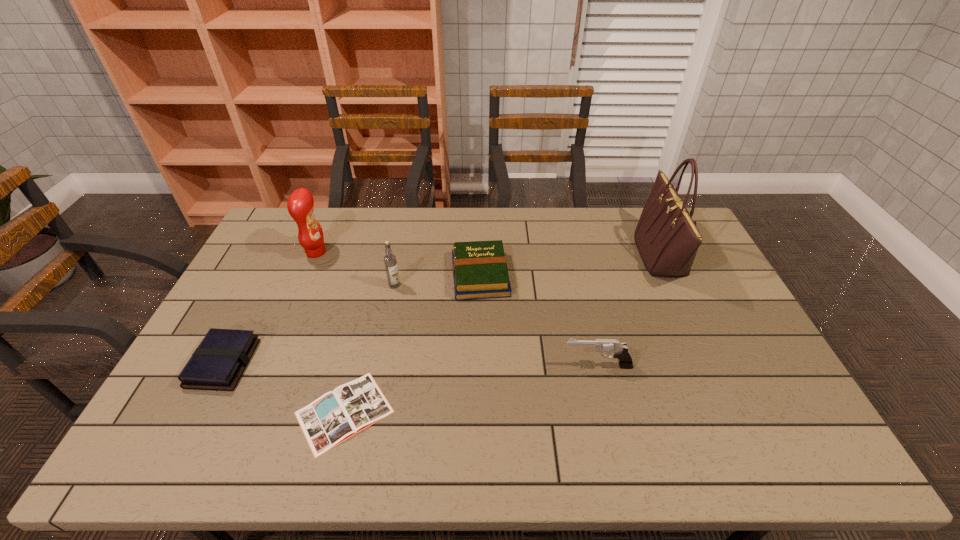
Where is `the leftmost book`? The width and height of the screenshot is (960, 540). the leftmost book is located at coordinates (219, 361).

The image size is (960, 540). I want to click on the second book from left to right, so click(x=337, y=415).

In order to click on the shortest book in this screenshot , I will do `click(337, 415)`.

At what (x,y) coordinates should I click in order to perform the action: click on free spot located 0.190m on the front-facing side of the handbag. Please return your answer as a coordinate pair (x, y). Image resolution: width=960 pixels, height=540 pixels. Looking at the image, I should click on (585, 256).

You are a GUI agent. You are given a task and a screenshot of the screen. Output one action in this format:
    pyautogui.click(x=<x>, y=<y>)
    Task: Click on the blank space located 0.150m on the front-facing side of the handbag
    The width and height of the screenshot is (960, 540).
    Given the screenshot: What is the action you would take?
    pyautogui.click(x=596, y=256)

I want to click on free space located 0.230m on the front-facing side of the handbag, so click(x=573, y=256).

Identify the location of vacant space located on the label side of the second object from left to right. Image resolution: width=960 pixels, height=540 pixels. (397, 252).

The width and height of the screenshot is (960, 540). What are the coordinates of `vacant space located 0.110m on the label of the third tallest object` in the screenshot? It's located at (389, 315).

This screenshot has height=540, width=960. I want to click on free space located 0.400m at the muzzle of the gun, so click(418, 366).

In order to click on free space located 0.310m at the muzzle of the gun in this screenshot , I will do `click(450, 366)`.